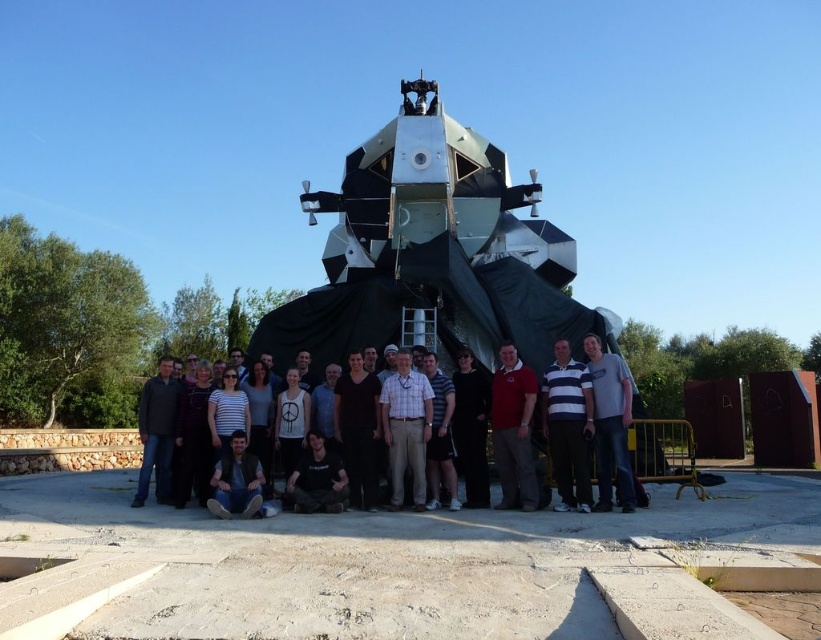
Question: Which of the following is the closest to the observer?

Choices:
 (A) black matte dress at center
 (B) gray cotton shirt at center
 (C) dark brown leather jacket at lower center

Answer: (C)

Question: Which object appears closest to the camera in this image?

Choices:
 (A) black matte shirt at center
 (B) matte black shirt at center

Answer: (B)

Question: Considering the relative positions of gray cotton shirt at center and black matte dress at center in the image provided, where is gray cotton shirt at center located with respect to black matte dress at center?

Choices:
 (A) right
 (B) left

Answer: (A)

Question: Estimate the real-world distances between objects in this image. Which object is closer to the black matte shirt at center?

Choices:
 (A) striped cotton shirt at center
 (B) matte red shirt at center
 (C) black matte dress at center

Answer: (C)

Question: Can you confirm if matte black shirt at center is smaller than gray cotton shirt at center?

Choices:
 (A) no
 (B) yes

Answer: (A)

Question: Can you confirm if striped cotton shirt at center is bigger than black matte shirt at center?

Choices:
 (A) no
 (B) yes

Answer: (B)